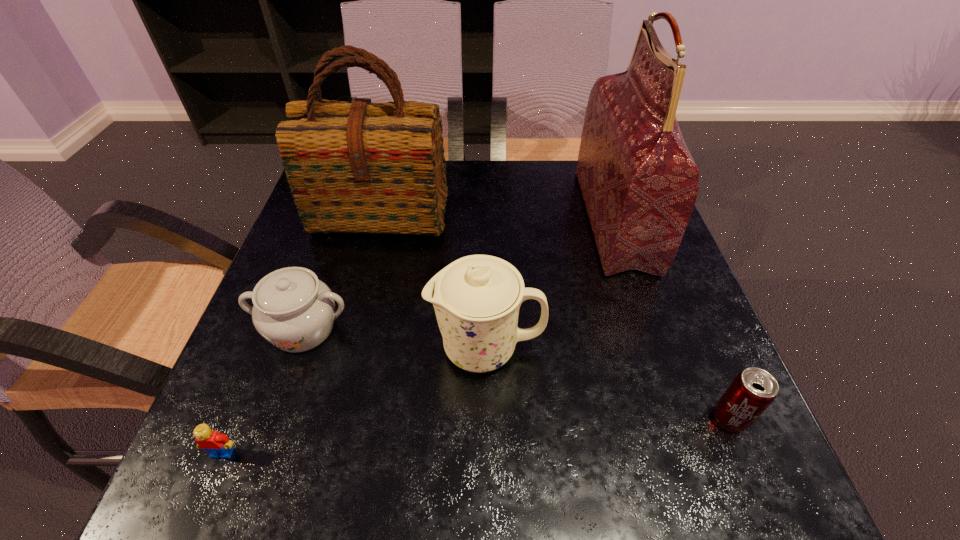
Where is `object positioned at the far right corner`? object positioned at the far right corner is located at coordinates (639, 182).

What are the coordinates of `blank space at the far edge of the desktop` in the screenshot? It's located at (564, 208).

Where is `free space at the near edge of the desktop`? Image resolution: width=960 pixels, height=540 pixels. free space at the near edge of the desktop is located at coordinates (463, 445).

In the image, there is a desktop. Identify the location of vacant space at the right edge. (612, 286).

Image resolution: width=960 pixels, height=540 pixels. Identify the location of free space at the near left corner. (287, 456).

Locate an element on the screen. The width and height of the screenshot is (960, 540). vacant space that is in between the third tallest object and the beer can is located at coordinates (608, 383).

This screenshot has width=960, height=540. I want to click on empty space between the nearest object and the left chinaware, so click(263, 390).

At what (x,y) coordinates should I click in order to perform the action: click on blank region between the beer can and the right chinaware. Please return your answer as a coordinate pair (x, y). The image size is (960, 540). Looking at the image, I should click on (608, 383).

The height and width of the screenshot is (540, 960). Identify the location of vacant area that lies between the fifth shortest object and the fifth farthest object. (555, 315).

Identify the location of blank region between the Lego and the fourth tallest object. click(x=263, y=390).